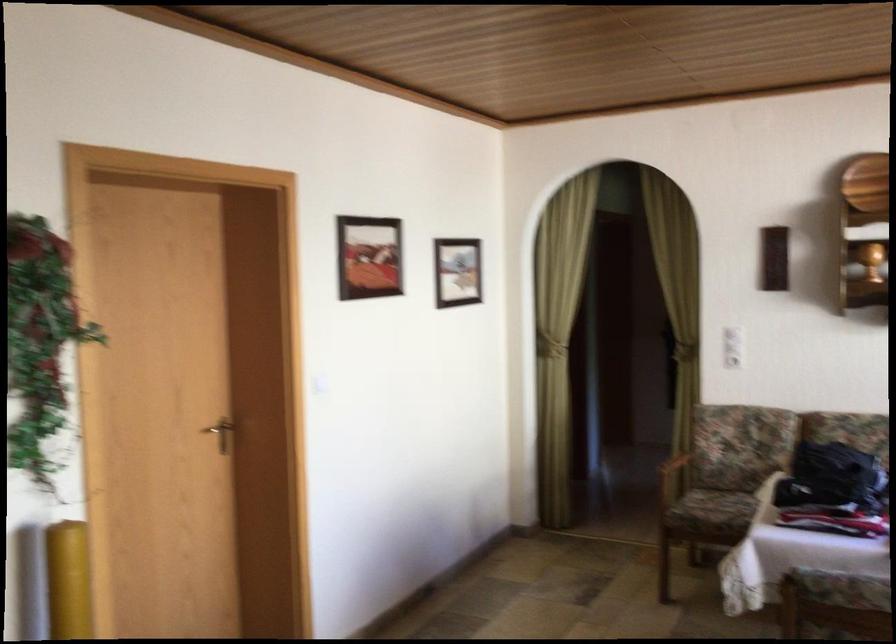
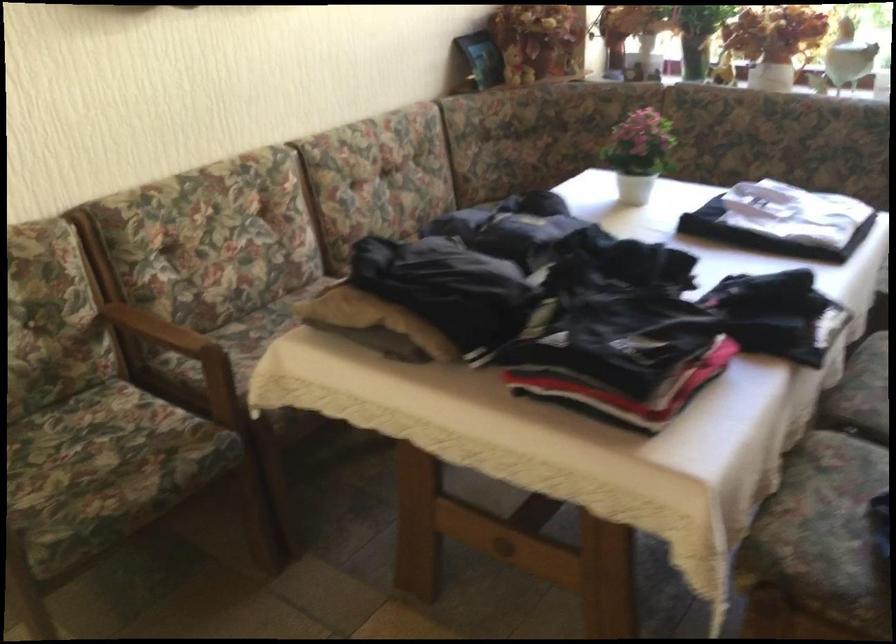
In the second image, find the point that corresponds to [789,455] in the first image.

(351, 307)